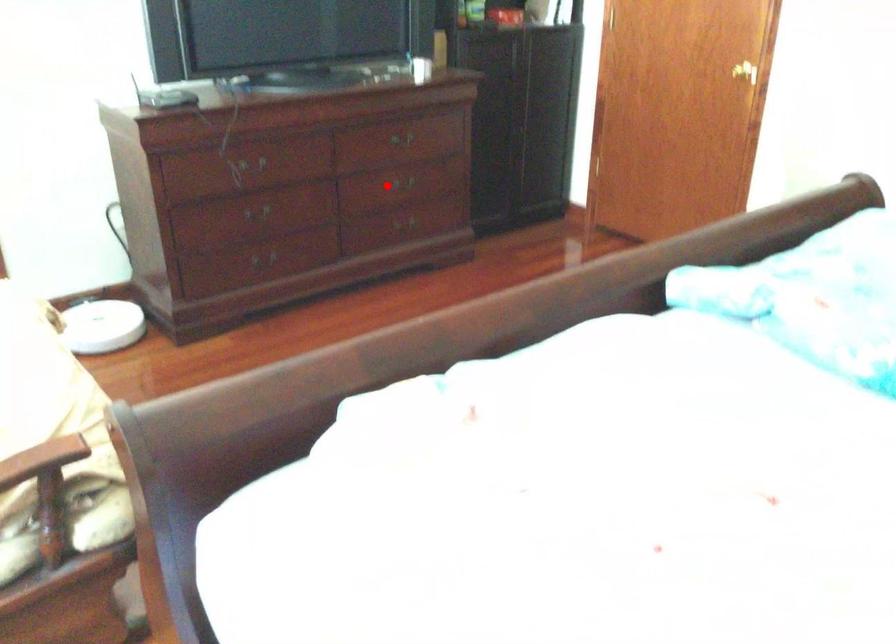
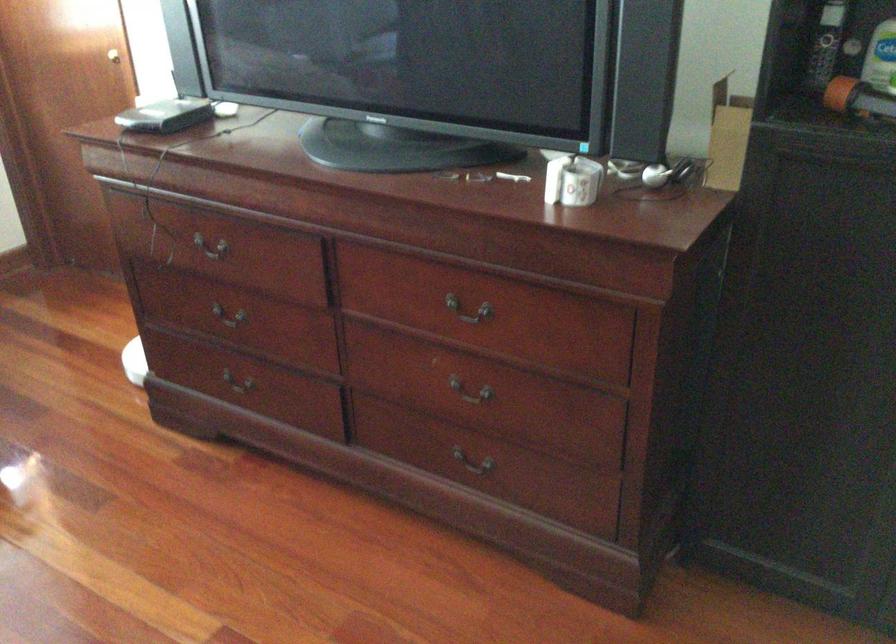
Question: A red point is marked in image1. In image2, is the corresponding 3D point closer to the camera or farther? Reply with the corresponding letter.

Choices:
 (A) The corresponding 3D point is closer.
 (B) The corresponding 3D point is farther.

Answer: (A)